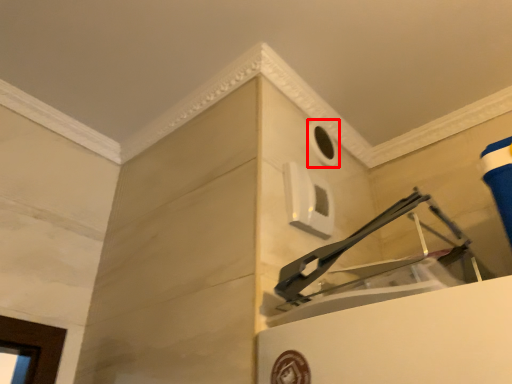
Question: Where is hole (annotated by the red box) located in relation to window in the image?

Choices:
 (A) right
 (B) left

Answer: (A)